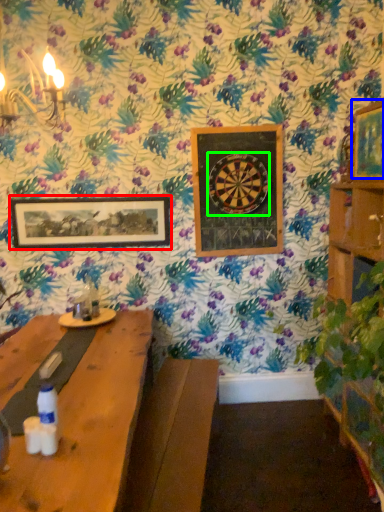
Question: Which object is positioned farthest from picture frame (highlighted by a red box)? Select from picture frame (highlighted by a blue box) and design (highlighted by a green box).

Choices:
 (A) picture frame
 (B) design

Answer: (A)